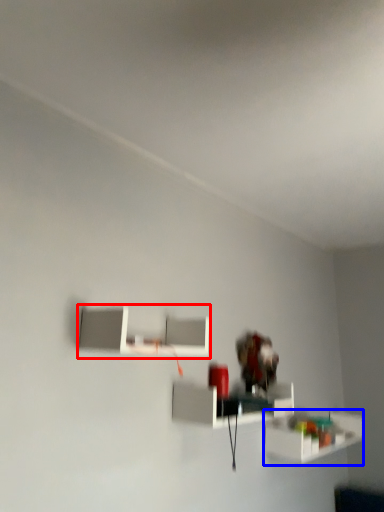
Question: Which point is closer to the camera, shelf (highlighted by a red box) or shelf (highlighted by a blue box)?

Choices:
 (A) shelf
 (B) shelf

Answer: (A)